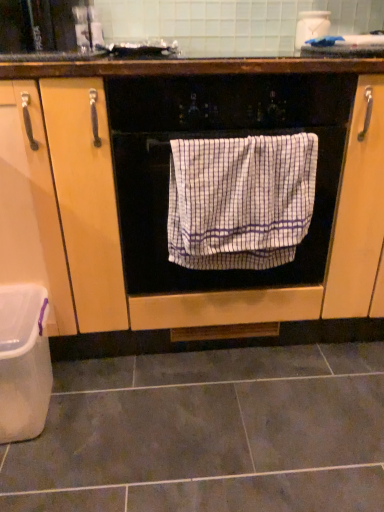
Find the location of a particular element. This screenshot has width=384, height=512. vacant space situated above white plastic container at lower left (from a real-world perspective) is located at coordinates (15, 305).